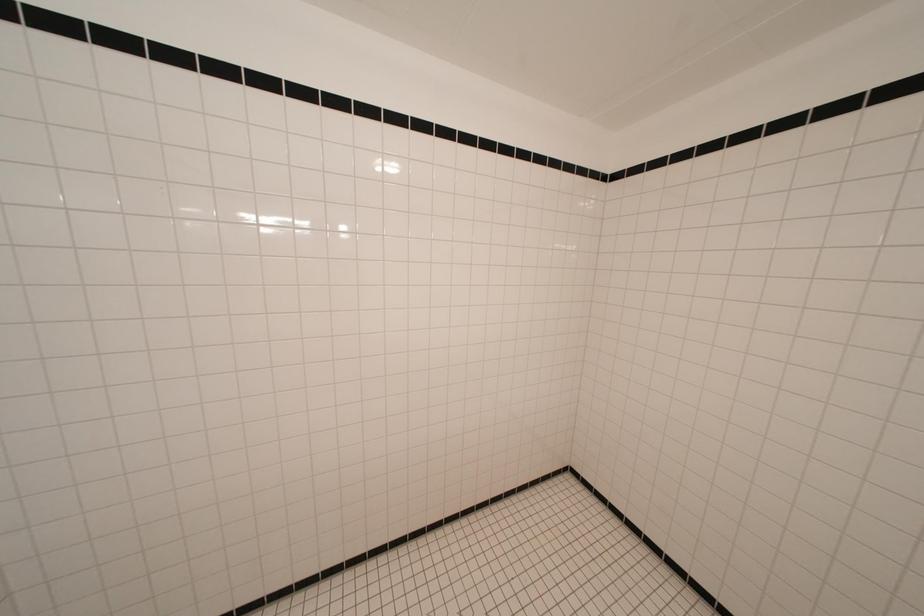
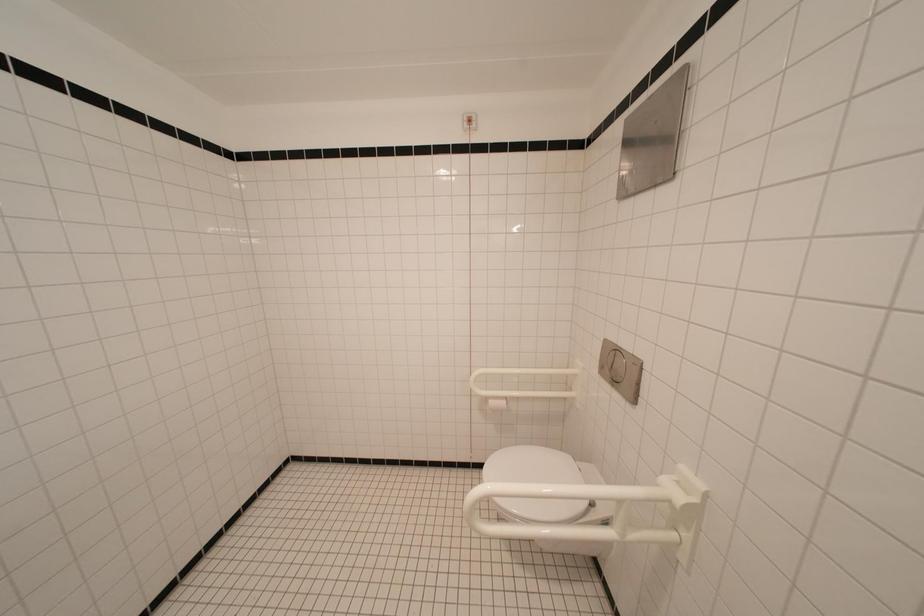
Question: Based on the continuous images, in which direction is the camera rotating? Reply with the corresponding letter.

Choices:
 (A) Left
 (B) Right
 (C) Up
 (D) Down

Answer: (B)